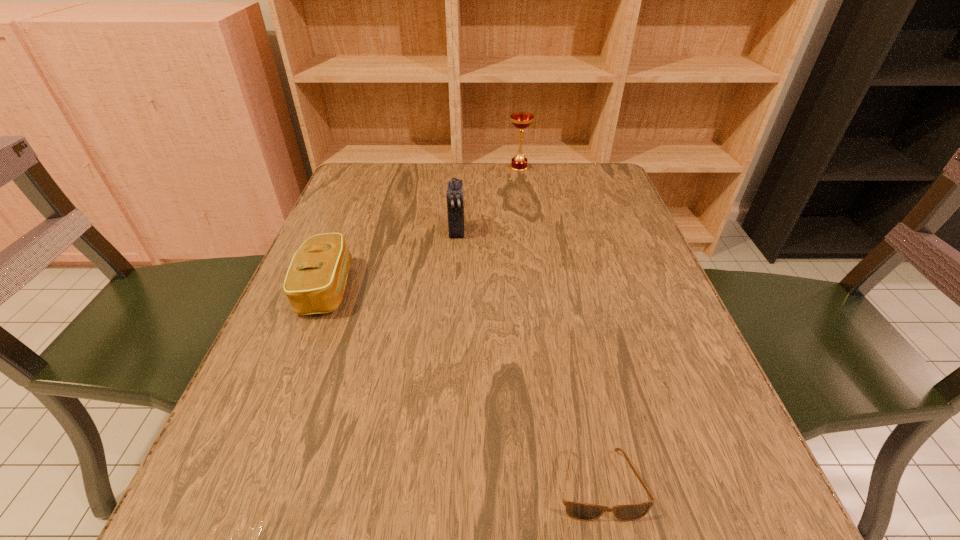
Where is `object present at the far edge`? The height and width of the screenshot is (540, 960). object present at the far edge is located at coordinates (521, 120).

Locate an element on the screen. This screenshot has width=960, height=540. object present at the near edge is located at coordinates (580, 511).

The height and width of the screenshot is (540, 960). Find the location of `object that is at the left edge`. object that is at the left edge is located at coordinates tap(315, 281).

What are the coordinates of `object that is at the right edge` in the screenshot? It's located at (580, 511).

Identify the location of object located at the near right corner. The height and width of the screenshot is (540, 960). (580, 511).

In the image, there is a desktop. Where is `vacant space at the far edge`? vacant space at the far edge is located at coordinates (469, 205).

At what (x,y) coordinates should I click in order to perform the action: click on vacant point at the near edge. Please return your answer as a coordinate pair (x, y). Looking at the image, I should click on (617, 501).

This screenshot has height=540, width=960. I want to click on free space at the left edge of the desktop, so click(x=278, y=358).

Find the location of `vacant space at the right edge of the desktop`. vacant space at the right edge of the desktop is located at coordinates (641, 255).

The height and width of the screenshot is (540, 960). In the image, there is a desktop. What are the coordinates of `vacant space at the far left corner` in the screenshot? It's located at (391, 162).